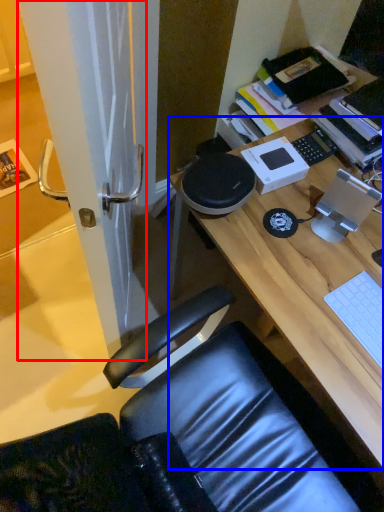
Question: Which point is further to the camera, screen door (highlighted by a red box) or desk (highlighted by a blue box)?

Choices:
 (A) screen door
 (B) desk

Answer: (B)